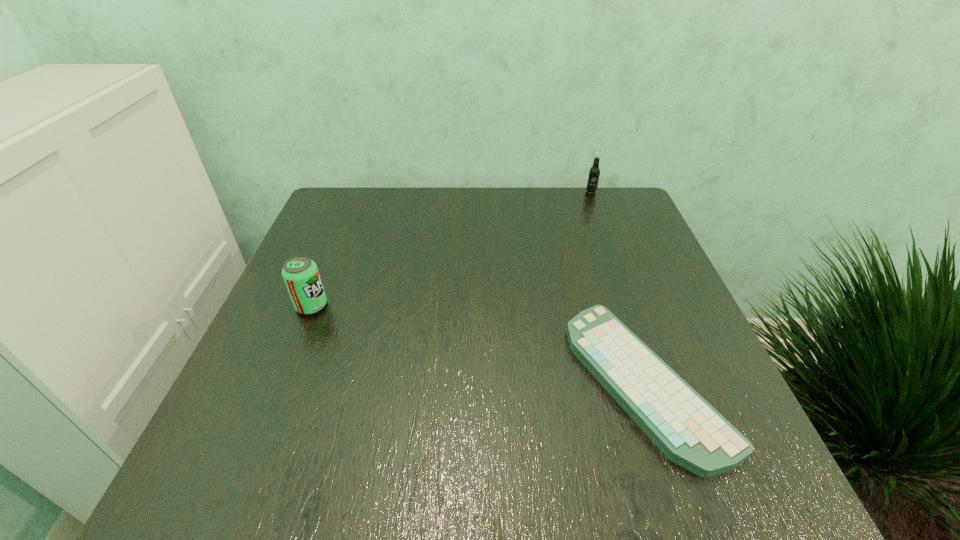
I want to click on unoccupied area between the farthest object and the leftmost object, so click(451, 248).

Find the location of a particular element. This screenshot has height=540, width=960. free point between the leftmost object and the farthest object is located at coordinates (451, 248).

Locate an element on the screen. This screenshot has height=540, width=960. vacant area that lies between the pop soda and the shortest object is located at coordinates (478, 343).

I want to click on vacant region between the computer keyboard and the root beer, so click(x=618, y=286).

The width and height of the screenshot is (960, 540). I want to click on free area in between the leftmost object and the root beer, so click(x=451, y=248).

In order to click on unoccupied area between the pop soda and the root beer in this screenshot , I will do `click(451, 248)`.

This screenshot has height=540, width=960. In order to click on vacant space in between the farthest object and the computer keyboard in this screenshot , I will do `click(618, 286)`.

The height and width of the screenshot is (540, 960). I want to click on free area in between the computer keyboard and the pop soda, so coord(478,343).

Identify which object is the nearest to the leftmost object. Please provide its 2D coordinates. Your answer should be formatted as a tuple, i.e. [(x, y)], where the tuple contains the x and y coordinates of a point satisfying the conditions above.

[(691, 433)]

The image size is (960, 540). I want to click on object that is the closest to the root beer, so click(691, 433).